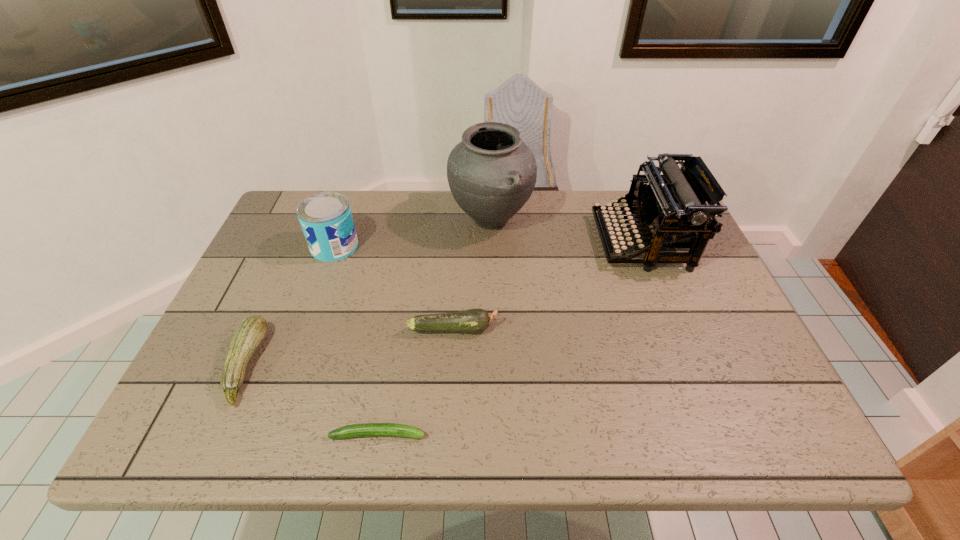
The width and height of the screenshot is (960, 540). I want to click on object situated at the right edge, so click(x=671, y=207).

Find the location of a particular element. The image size is (960, 540). object located in the far left corner section of the desktop is located at coordinates (326, 220).

Identify the location of object located in the near left corner section of the desktop. This screenshot has height=540, width=960. (250, 333).

I want to click on object at the far right corner, so click(x=671, y=207).

Find the location of a particular element. Image resolution: width=960 pixels, height=540 pixels. blank space at the far edge is located at coordinates (588, 192).

You are a GUI agent. You are given a task and a screenshot of the screen. Output one action in this format:
    pyautogui.click(x=<x>, y=<y>)
    Task: Click on the vacant space at the near edge of the desktop
    
    Given the screenshot: What is the action you would take?
    click(710, 440)

The image size is (960, 540). In the image, there is a desktop. In order to click on vacant space at the left edge in this screenshot , I will do `click(264, 242)`.

The width and height of the screenshot is (960, 540). In the image, there is a desktop. Identify the location of vacant space at the right edge. (670, 271).

This screenshot has height=540, width=960. In the image, there is a desktop. In order to click on vacant space at the far left corner in this screenshot , I will do `click(294, 225)`.

Locate an element on the screen. The height and width of the screenshot is (540, 960). vacant space at the near right corner is located at coordinates (777, 408).